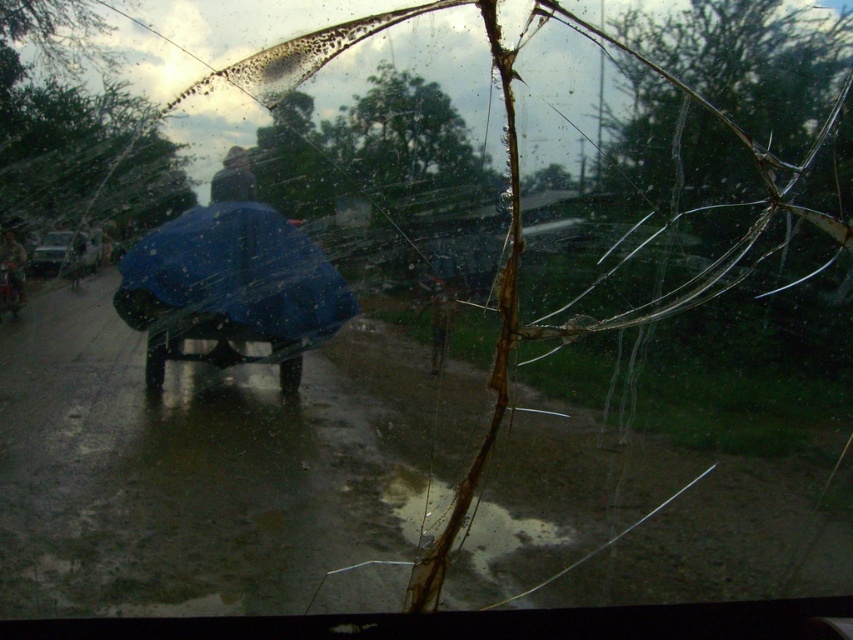
You are a passenger in the damaged vehicle and notice the metallic silver car at left and the blue fabric umbrella at left outside. From your perspective inside the car, which object is positioned more to the east? Please explain your reasoning based on the scene description.

The metallic silver car at left is to the right of the blue fabric umbrella at left. Since the scene is viewed from inside the vehicle looking out, and the metallic silver car is positioned to the right of the umbrella, the car would be more to the east if the umbrella is on the west side. However, without knowing the vehicle orientation, we can only state their relative positions. The metallic silver car at left is eastward of the blue fabric umbrella at left.

You are a passenger in the damaged vehicle and want to exit to reach the blue fabric umbrella at left. Is the metallic silver car at left blocking your path to the umbrella?

The blue fabric umbrella at left is behind the metallic silver car at left, so the metallic silver car at left is blocking the path to the umbrella.